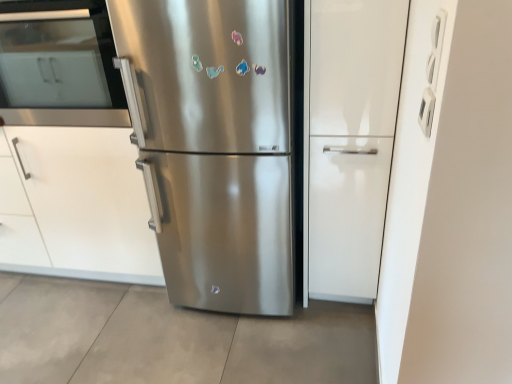
Question: Does white glossy cabinet at center have a lesser width compared to white matte cabinet at left?

Choices:
 (A) no
 (B) yes

Answer: (B)

Question: Does white glossy cabinet at center have a smaller size compared to white matte cabinet at left?

Choices:
 (A) no
 (B) yes

Answer: (B)

Question: Does white glossy cabinet at center appear on the left side of white matte cabinet at left?

Choices:
 (A) yes
 (B) no

Answer: (B)

Question: Considering the relative sizes of white glossy cabinet at center and white matte cabinet at left in the image provided, is white glossy cabinet at center wider than white matte cabinet at left?

Choices:
 (A) yes
 (B) no

Answer: (B)

Question: Would you say white glossy cabinet at center is outside white matte cabinet at left?

Choices:
 (A) yes
 (B) no

Answer: (A)

Question: Is point (81, 16) closer or farther from the camera than point (74, 223)?

Choices:
 (A) closer
 (B) farther

Answer: (A)

Question: Considering the positions of stainless steel oven at left and white matte cabinet at left in the image, is stainless steel oven at left wider or thinner than white matte cabinet at left?

Choices:
 (A) thin
 (B) wide

Answer: (A)

Question: Is stainless steel oven at left to the left or to the right of white matte cabinet at left in the image?

Choices:
 (A) left
 (B) right

Answer: (B)

Question: Is stainless steel oven at left taller or shorter than white matte cabinet at left?

Choices:
 (A) tall
 (B) short

Answer: (B)

Question: From a real-world perspective, is white matte cabinet at left physically located above or below stainless steel oven at left?

Choices:
 (A) above
 (B) below

Answer: (B)

Question: Is white matte cabinet at left bigger or smaller than stainless steel oven at left?

Choices:
 (A) small
 (B) big

Answer: (B)

Question: In the image, is white matte cabinet at left on the left side or the right side of stainless steel oven at left?

Choices:
 (A) left
 (B) right

Answer: (A)

Question: In terms of height, does white matte cabinet at left look taller or shorter compared to stainless steel oven at left?

Choices:
 (A) short
 (B) tall

Answer: (B)

Question: From a real-world perspective, is stainless steel refrigerator at center above or below white matte cabinet at left?

Choices:
 (A) below
 (B) above

Answer: (B)

Question: Is stainless steel refrigerator at center bigger or smaller than white matte cabinet at left?

Choices:
 (A) big
 (B) small

Answer: (A)